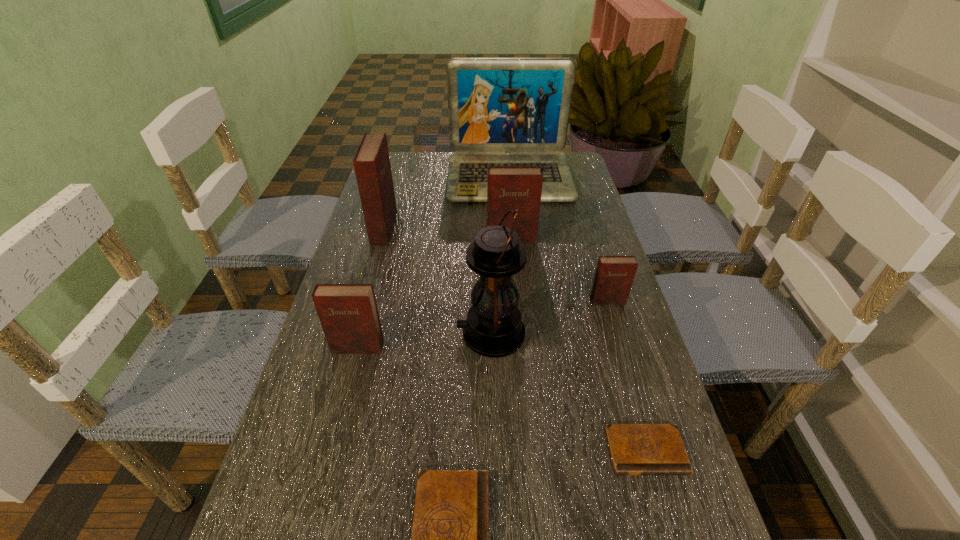
You are a GUI agent. You are given a task and a screenshot of the screen. Output one action in this format:
    pyautogui.click(x=<x>, y=<y>)
    Task: Click on the object located at the far edge
    
    Given the screenshot: What is the action you would take?
    pyautogui.click(x=502, y=111)

I want to click on laptop computer that is at the right edge, so click(x=502, y=111).

The image size is (960, 540). In order to click on object situated at the far right corner in this screenshot , I will do `click(502, 111)`.

Where is `free point at the far edge`? This screenshot has width=960, height=540. free point at the far edge is located at coordinates [444, 181].

In order to click on vacant area at the left edge in this screenshot , I will do `click(412, 226)`.

Where is `vacant space at the right edge of the desktop`? The image size is (960, 540). vacant space at the right edge of the desktop is located at coordinates (612, 364).

At what (x,y) coordinates should I click in order to perform the action: click on free spot between the second tallest diary and the shortest diary. Please return your answer as a coordinate pair (x, y). Looking at the image, I should click on (579, 345).

Locate an element on the screen. The width and height of the screenshot is (960, 540). free space between the second tallest diary and the third biggest reddish-brown diary is located at coordinates (434, 293).

I want to click on blank region between the black lantern and the third nearest diary, so click(x=424, y=341).

Find the location of `vacant area that lies between the laptop computer and the shortest diary`. vacant area that lies between the laptop computer and the shortest diary is located at coordinates (578, 314).